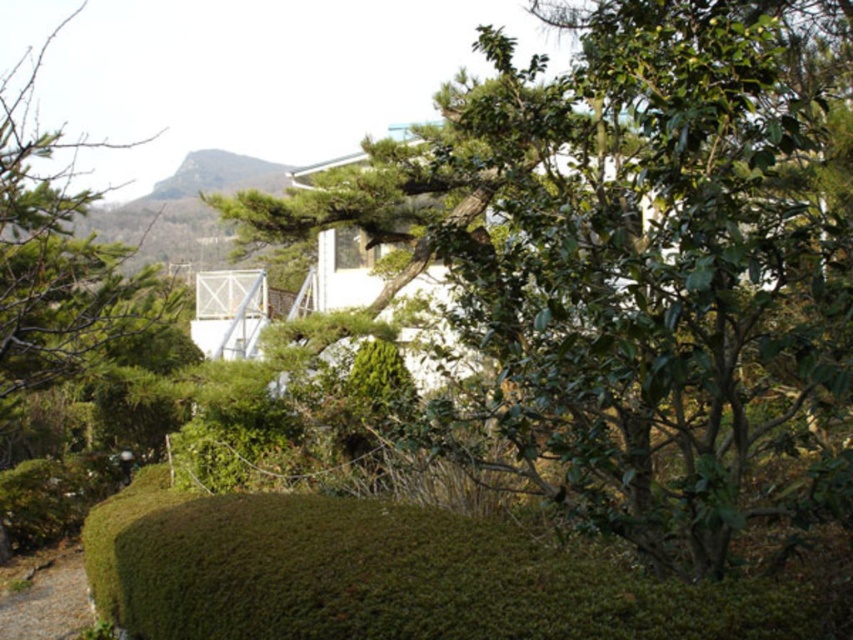
You are a gardener planning to trim the green leafy tree at center and the green mossy hedge at lower center. Considering their sizes, which one would require more time and effort to trim?

The green leafy tree at center has a larger size compared to the green mossy hedge at lower center, so it would require more time and effort to trim.

You are planning to place a 1.5 meter wide garden bench between the green leafy tree at center and the green mossy hedge at lower center. Based on their widths, will the bench fit comfortably between them without touching either?

The green leafy tree at center is thinner than the green mossy hedge at lower center. Since the bench is 1.5 meters wide, it depends on the actual widths of the tree and hedge. However, since the tree is thinner, the combined space between them might accommodate the bench, but precise measurements are needed for confirmation.